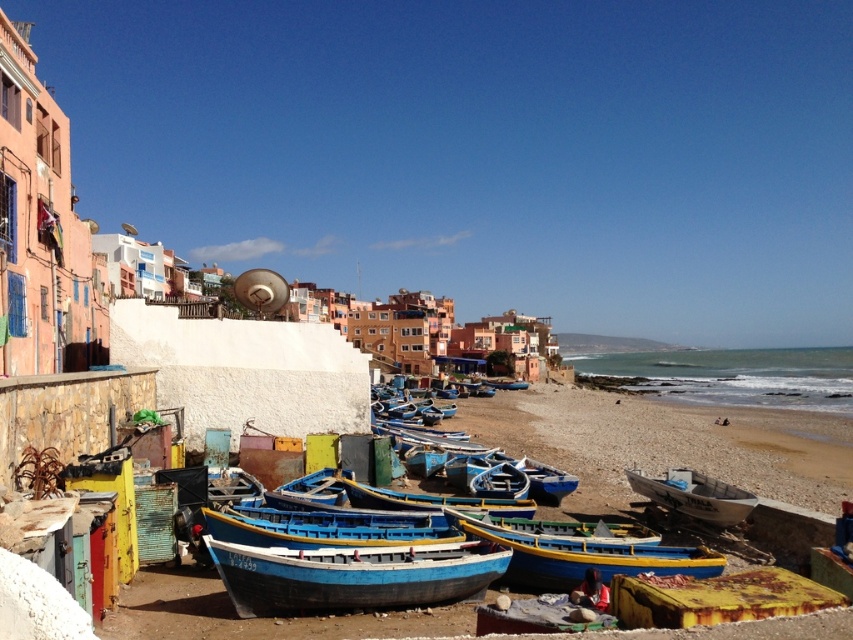
You are a tourist planning to rent a boat for a short trip along the coast. You see the yellow painted wood canoe at center and the blue painted wood boat at center. Which one is wider?

The yellow painted wood canoe at center is wider than the blue painted wood boat at center according to the description.

You are standing on the beach and want to take a photo of both the blue painted wood boat at lower center and the yellow painted wood canoe at center. Which boat should you move closer to in order to have both in the frame?

You should move closer to the blue painted wood boat at lower center because it is in front of the yellow painted wood canoe at center, so adjusting your position to focus on the front boat will help include both in the photo.